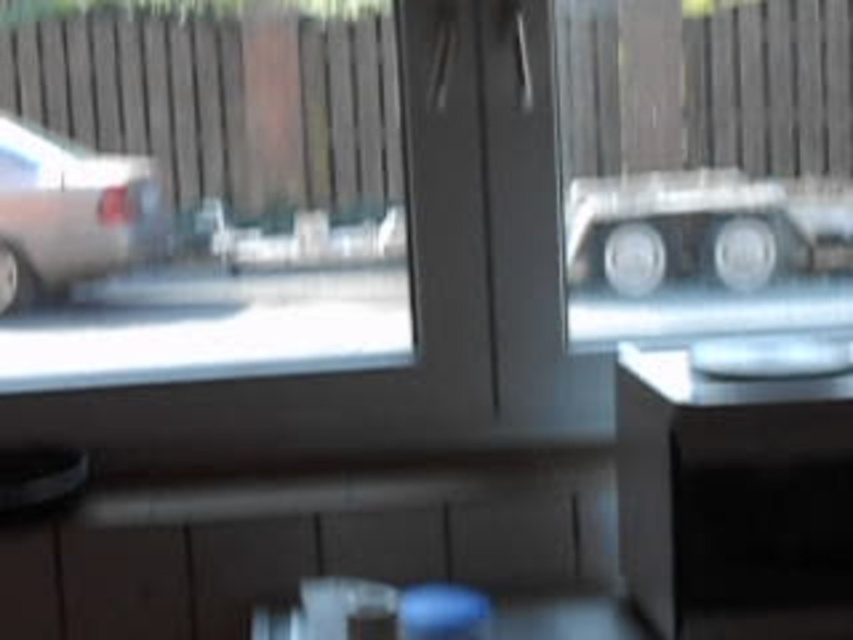
You are standing in the room and want to look outside through the clear glass window at upper left. However, there is a silver metallic car at left blocking your view. Can you see the street scene outside through the window without moving the car?

The clear glass window at upper left is further to the viewer than the silver metallic car at left, so the car is closer to you and blocking your view. You cannot see the street scene outside through the window without moving the car.

You are a delivery robot with a width of 10 centimeters. You need to pass through the space between the clear glass window at upper left and the silver metallic car at left. Can you fit through that space?

The space between the clear glass window at upper left and the silver metallic car at left is 9.94 centimeters. Since your width is 10 centimeters, you cannot fit through that space as it is slightly narrower than your width.

You are standing in the room and want to know if the point at coordinates (202, 196) is on the window. Based on the scene description, can you determine this?

Yes, the point at coordinates (202, 196) is on the clear glass window at upper left according to the objects description.